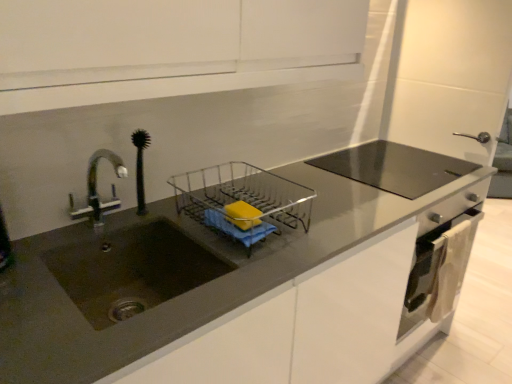
Where is `unoccupied region to the right of clear plastic dish rack at center`? The width and height of the screenshot is (512, 384). unoccupied region to the right of clear plastic dish rack at center is located at coordinates (322, 216).